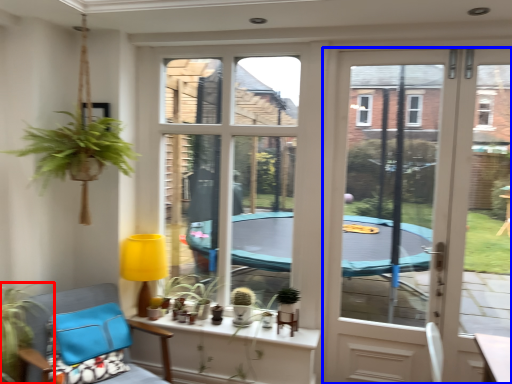
Question: Which object is further to the camera taking this photo, houseplant (highlighted by a red box) or door (highlighted by a blue box)?

Choices:
 (A) houseplant
 (B) door

Answer: (B)